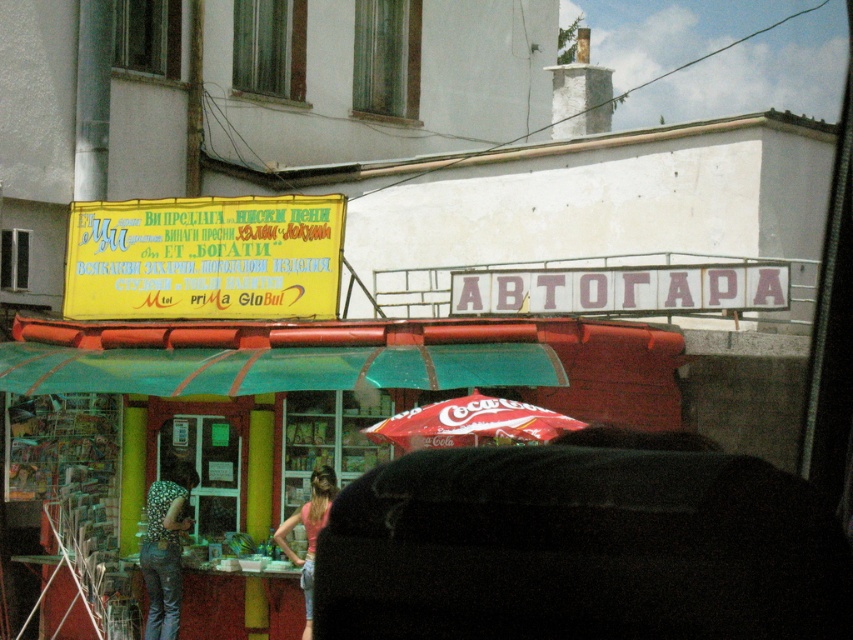
Looking at this image, you are standing outside the shop and want to approach the entrance. There are two points marked on the ground near the entrance. The first point is at coordinate point (90, 266) and the second is at point (154, 504). Which point is closer to you as you stand outside?

Point (90, 266) is closer to you because it is further to the camera than point (154, 504), meaning it is nearer to your current position outside the shop.